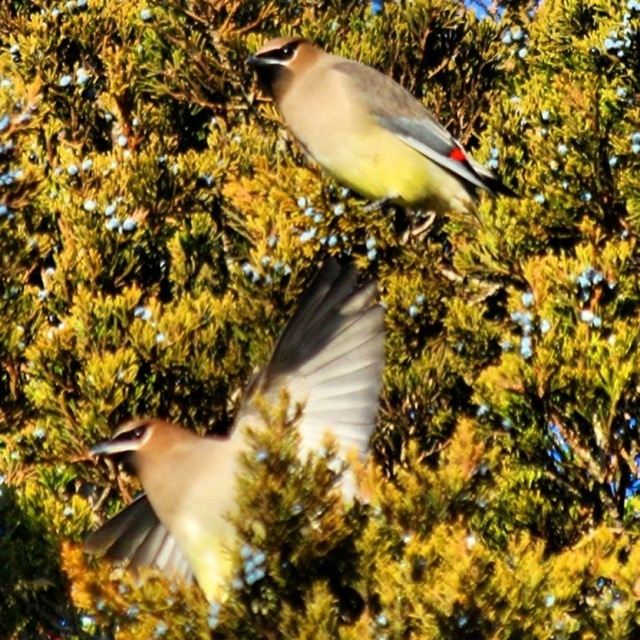
Question: Can you confirm if matte brown bird at center is positioned below matte gray bird at upper center?

Choices:
 (A) yes
 (B) no

Answer: (A)

Question: Does matte brown bird at center come behind matte gray bird at upper center?

Choices:
 (A) yes
 (B) no

Answer: (B)

Question: Among these points, which one is nearest to the camera?

Choices:
 (A) (444, 180)
 (B) (204, 528)

Answer: (B)

Question: Does matte brown bird at center appear over matte gray bird at upper center?

Choices:
 (A) no
 (B) yes

Answer: (A)